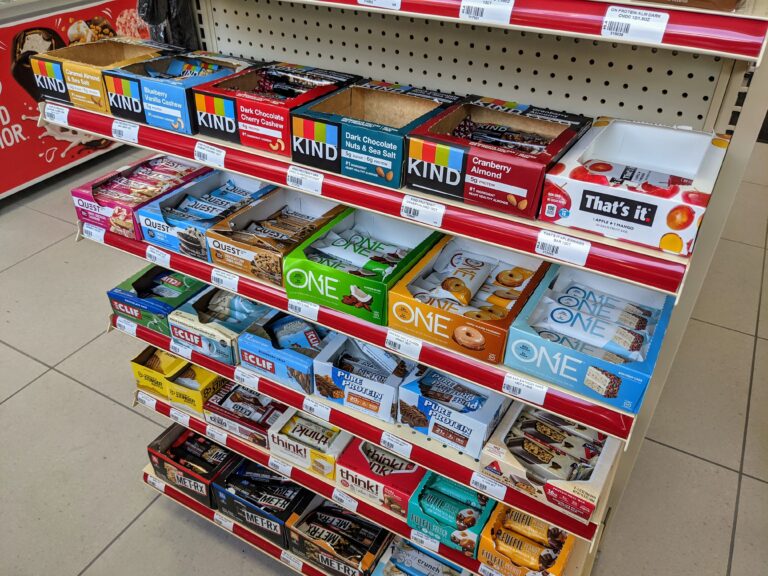
Locate an element on the screen. Image resolution: width=768 pixels, height=576 pixels. beige edge of shelf is located at coordinates (713, 232).